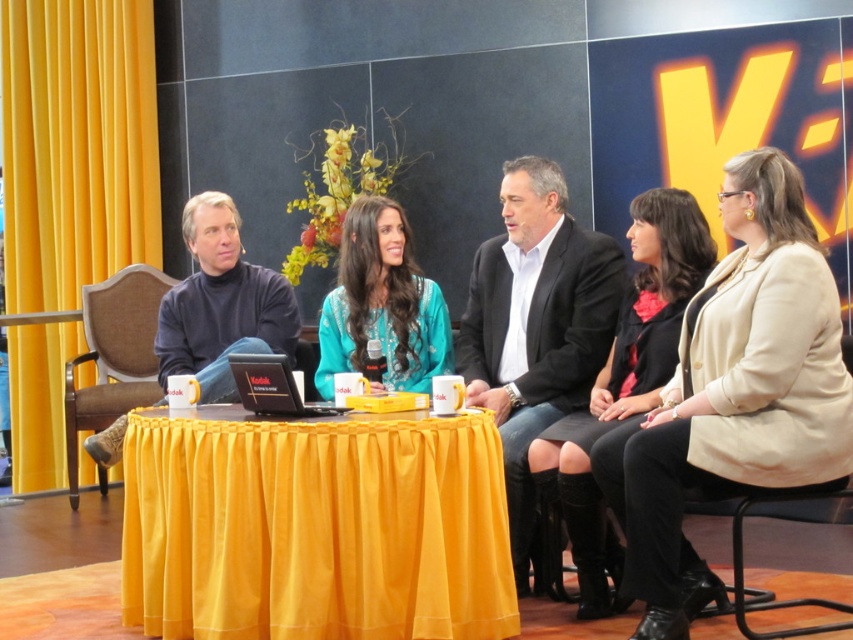
You are a photographer setting up for a talk show. You have a yellow fabric curtain at left and a black plastic laptop at center in your frame. Which object takes up more space in the image?

The yellow fabric curtain at left takes up more space in the image as it is larger in size than the black plastic laptop at center.

You are a stagehand preparing to adjust the lighting for the panel discussion. You need to ensure that the yellow fabric curtain at left and the black leather skirt at center are both visible under the lights. Given their heights, which object might require a higher light fixture to properly illuminate its entire surface?

The yellow fabric curtain at left has a greater height compared to the black leather skirt at center, so it would require a higher light fixture to illuminate its entire surface.

You are a photographer setting up for a group photo. You need to position a spotlight on the black suit jacket at center and another on the turquoise fabric dress at center. Based on their positions, which object should you place the spotlight to the right of the other?

The black suit jacket at center is to the right of the turquoise fabric dress at center, so you should place the spotlight on the black suit jacket at center to the right of the spotlight on the turquoise fabric dress at center.